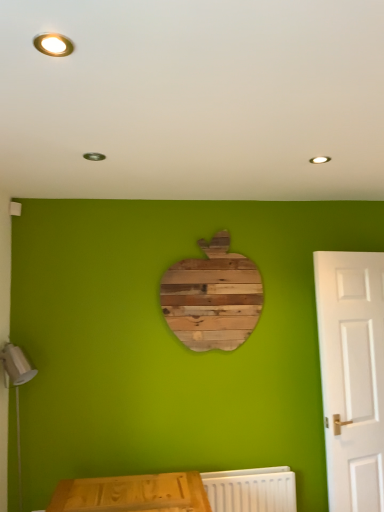
Identify the location of matte gold light at upper left. This screenshot has height=512, width=384. (53, 45).

Describe the element at coordinates (53, 45) in the screenshot. I see `matte gold light at upper left` at that location.

In order to click on matte gold light at upper left in this screenshot , I will do `click(53, 45)`.